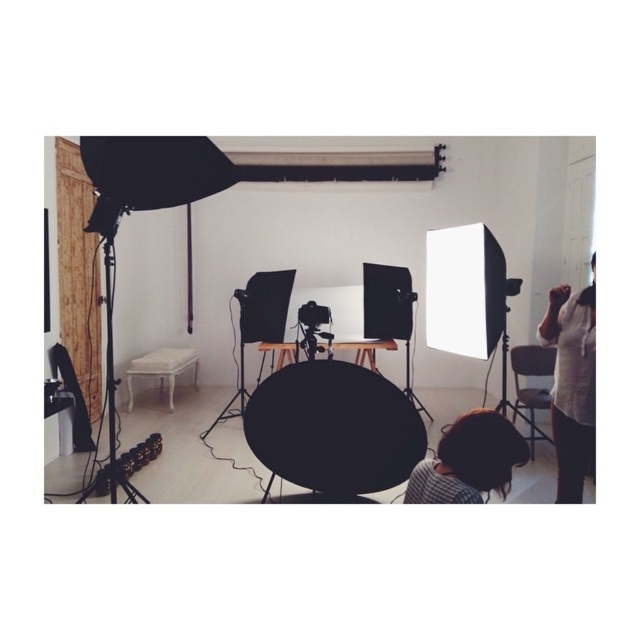
Is white cotton shirt at right taller than black matte tripod at left?

No.

Can you confirm if white cotton shirt at right is positioned above black matte tripod at left?

No, white cotton shirt at right is not above black matte tripod at left.

Is point (593, 358) behind point (109, 342)?

That is False.

I want to click on white cotton shirt at right, so click(x=572, y=384).

Does brown hair at lower center appear under black matte tripod at center?

Yes.

Based on the photo, who is higher up, brown hair at lower center or black matte tripod at center?

black matte tripod at center is higher up.

Which is in front, point (436, 445) or point (241, 321)?

Point (436, 445) is more forward.

This screenshot has width=640, height=640. I want to click on brown hair at lower center, so click(468, 460).

Can you confirm if white cotton shirt at right is positioned to the right of black matte tripod at center?

Indeed, white cotton shirt at right is positioned on the right side of black matte tripod at center.

Between white cotton shirt at right and black matte tripod at center, which one has more height?

white cotton shirt at right

Describe the element at coordinates (572, 384) in the screenshot. This screenshot has height=640, width=640. I see `white cotton shirt at right` at that location.

At what (x,y) coordinates should I click in order to perform the action: click on white cotton shirt at right. Please return your answer as a coordinate pair (x, y). The height and width of the screenshot is (640, 640). Looking at the image, I should click on (572, 384).